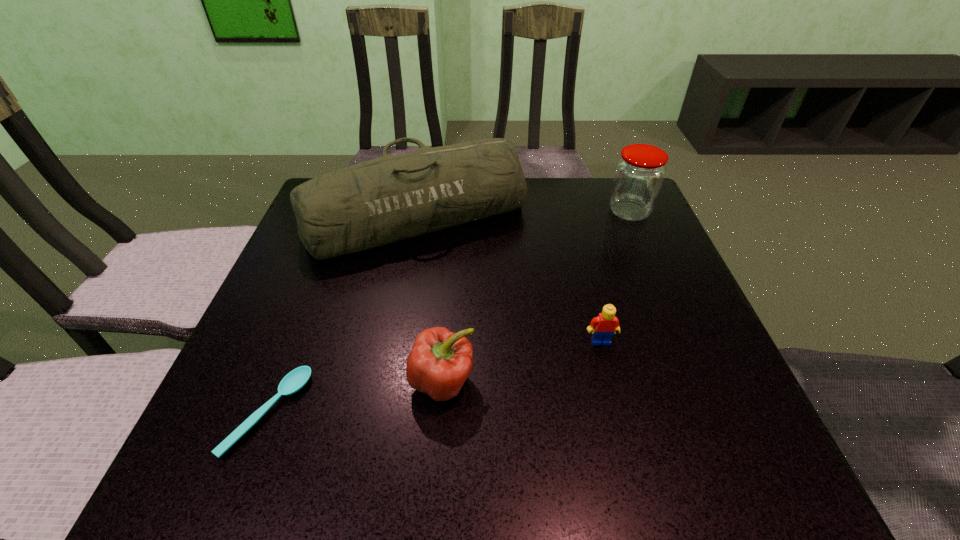
Identify the location of free space located 0.190m on the right of the shortest object. (419, 413).

At what (x,y) coordinates should I click in order to perform the action: click on duffel bag that is positioned at the far edge. Please return your answer as a coordinate pair (x, y). Looking at the image, I should click on (374, 203).

At what (x,y) coordinates should I click in order to perform the action: click on jar at the far edge. Please return your answer as a coordinate pair (x, y). Image resolution: width=960 pixels, height=540 pixels. Looking at the image, I should click on (639, 175).

I want to click on object positioned at the near edge, so click(296, 379).

Identify the location of duffel bag located in the left edge section of the desktop. The image size is (960, 540). (374, 203).

Identify the location of spoon present at the left edge. [296, 379].

At what (x,y) coordinates should I click in order to perform the action: click on object at the right edge. Please return your answer as a coordinate pair (x, y). The image size is (960, 540). Looking at the image, I should click on (639, 175).

Identify the location of object at the far left corner. The image size is (960, 540). (374, 203).

Find the location of a particular element. The width and height of the screenshot is (960, 540). object positioned at the near left corner is located at coordinates (296, 379).

Where is `object at the far right corner`? The height and width of the screenshot is (540, 960). object at the far right corner is located at coordinates (639, 175).